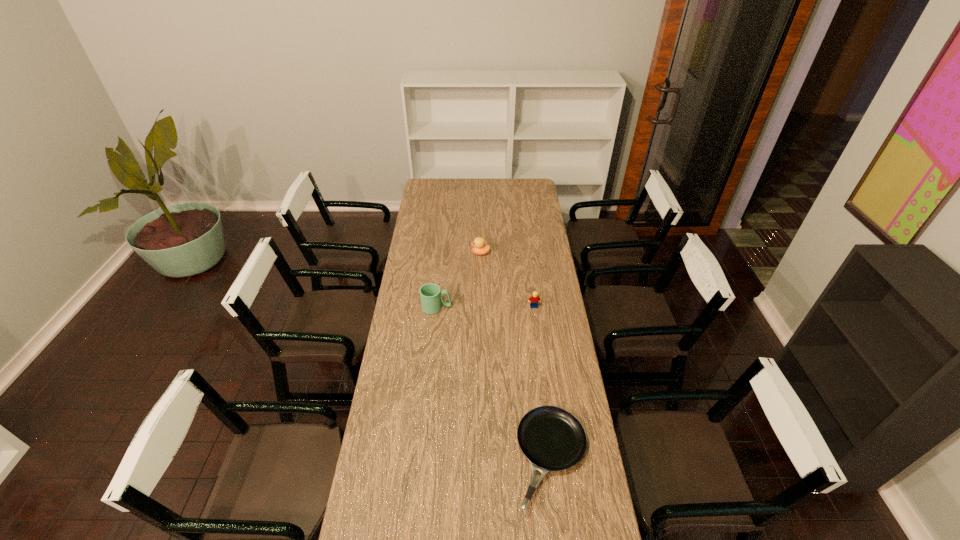
Identify which object is located as the third nearest to the farthest object. Please provide its 2D coordinates. Your answer should be formatted as a tuple, i.e. [(x, y)], where the tuple contains the x and y coordinates of a point satisfying the conditions above.

[(552, 439)]

Select which object appears as the third closest to the leftmost object. Please provide its 2D coordinates. Your answer should be formatted as a tuple, i.e. [(x, y)], where the tuple contains the x and y coordinates of a point satisfying the conditions above.

[(552, 439)]

Where is `vacant region that satisfies the following two spatial constraints: 1. on the back side of the pan; 2. on the face of the duckling`? vacant region that satisfies the following two spatial constraints: 1. on the back side of the pan; 2. on the face of the duckling is located at coordinates (527, 253).

Locate an element on the screen. The image size is (960, 540). vacant space that satisfies the following two spatial constraints: 1. on the face of the shortest object; 2. on the left side of the second object from left to right is located at coordinates (481, 458).

The image size is (960, 540). I want to click on vacant space that satisfies the following two spatial constraints: 1. on the front-facing side of the Lego; 2. on the side of the tallest object with the handle, so click(534, 308).

You are a GUI agent. You are given a task and a screenshot of the screen. Output one action in this format:
    pyautogui.click(x=<x>, y=<y>)
    Task: Click on the free location that satisfies the following two spatial constraints: 1. on the face of the pan; 2. on the right side of the farthest object
    Image resolution: width=960 pixels, height=540 pixels.
    Given the screenshot: What is the action you would take?
    pyautogui.click(x=481, y=458)

Where is `free point that satisfies the following two spatial constraints: 1. on the back side of the shortest object; 2. on the face of the second object from left to right`? This screenshot has height=540, width=960. free point that satisfies the following two spatial constraints: 1. on the back side of the shortest object; 2. on the face of the second object from left to right is located at coordinates (527, 253).

The height and width of the screenshot is (540, 960). What are the coordinates of `vacant space that satisfies the following two spatial constraints: 1. on the face of the duckling; 2. on the back side of the nearest object` in the screenshot? It's located at (481, 458).